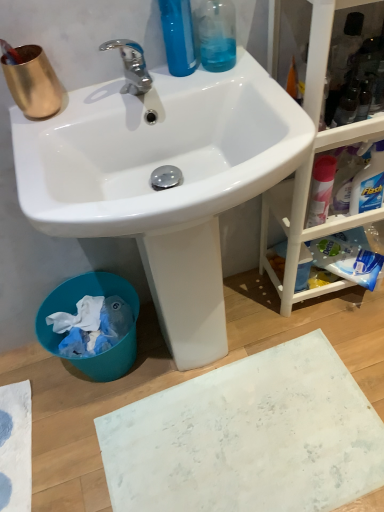
In order to click on free spot in front of white wood cabinet at right in this screenshot , I will do `click(346, 340)`.